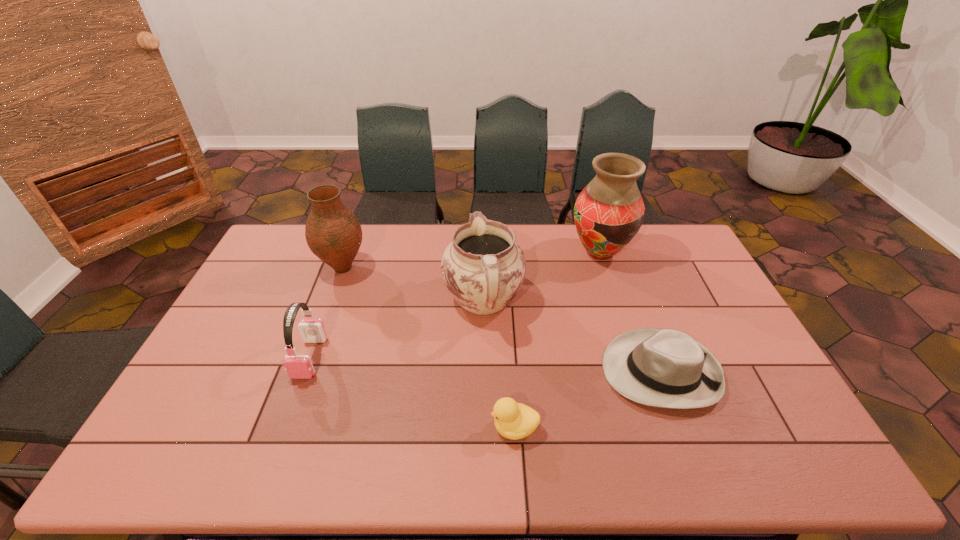
Locate an element on the screen. The height and width of the screenshot is (540, 960). vacant space located on the spout of the third tallest object is located at coordinates (483, 247).

Identify the location of vacant space located on the outer surface of the earphone. (276, 449).

Where is `free space located on the front-facing side of the fedora`? The width and height of the screenshot is (960, 540). free space located on the front-facing side of the fedora is located at coordinates point(578,372).

Locate an element on the screen. The width and height of the screenshot is (960, 540). vacant space located 0.280m on the front-facing side of the fedora is located at coordinates (503, 372).

The image size is (960, 540). What are the coordinates of `vacant region located 0.190m on the front-facing side of the fedora` in the screenshot? It's located at (536, 372).

Find the location of a particular element. The width and height of the screenshot is (960, 540). free space located 0.390m on the front-facing side of the duck is located at coordinates (334, 428).

This screenshot has width=960, height=540. Identify the location of vacant position located on the front-facing side of the duck. (334, 428).

I want to click on free space located on the front-facing side of the duck, so click(398, 428).

The height and width of the screenshot is (540, 960). Find the location of `object that is at the near edge`. object that is at the near edge is located at coordinates (513, 420).

The height and width of the screenshot is (540, 960). What are the coordinates of `object at the right edge` in the screenshot? It's located at (664, 368).